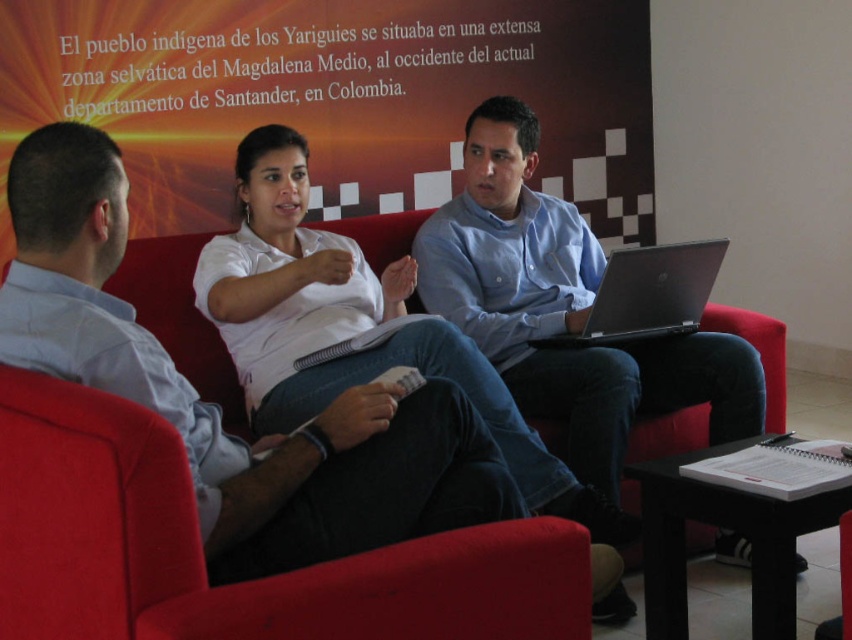
You are a photographer trying to capture a clear shot of both the white cotton shirt at center and the silver metallic laptop at center. Based on their positions, which object will appear larger in the photo?

The white cotton shirt at center will appear larger in the photo because it is closer to the viewer than the silver metallic laptop at center.

From the picture: You are a photographer taking a picture of the blue denim jeans at center and the white cotton shirt at center. Which one should you focus on if you want to capture the one that is higher up?

The blue denim jeans at center is located above the white cotton shirt at center, so you should focus on the blue denim jeans at center to capture the higher one.